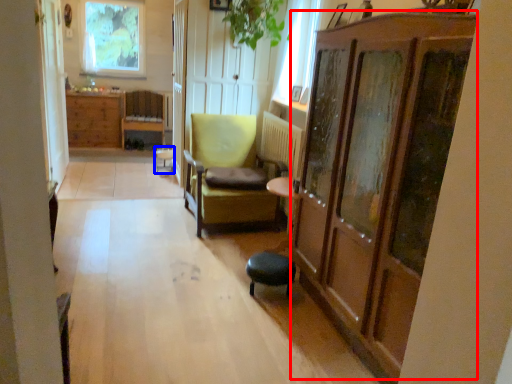
Question: Which object appears closest to the camera in this image, dresser (highlighted by a red box) or bar stool (highlighted by a blue box)?

Choices:
 (A) dresser
 (B) bar stool

Answer: (A)